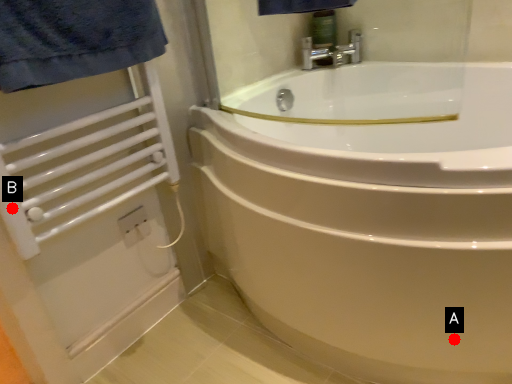
Question: Two points are circled on the image, labeled by A and B beside each circle. Which of the following is the closest to the observer?

Choices:
 (A) A is closer
 (B) B is closer

Answer: (B)